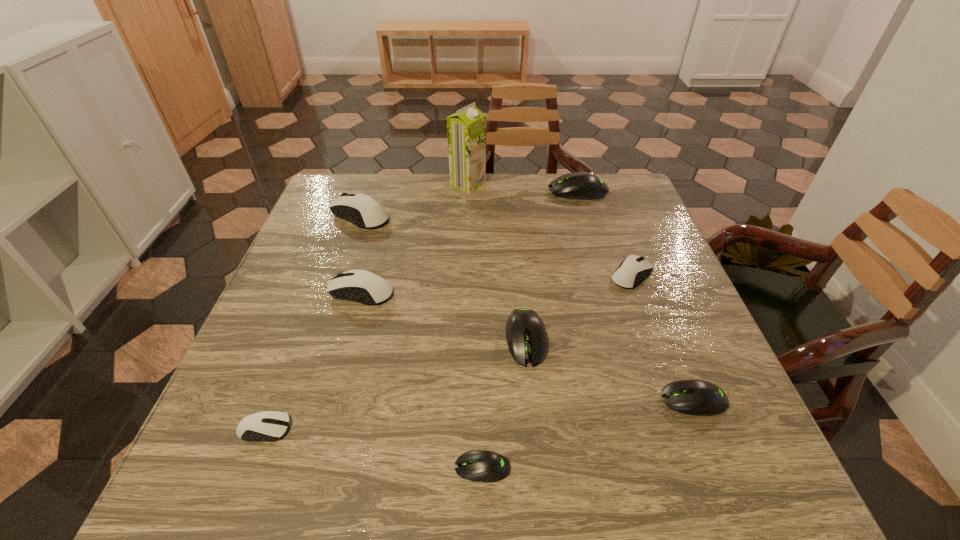
Image resolution: width=960 pixels, height=540 pixels. Identify the location of the third farthest gray computer mouse. click(693, 397).

Where is `the second smallest gray computer mouse`? The width and height of the screenshot is (960, 540). the second smallest gray computer mouse is located at coordinates (693, 397).

The width and height of the screenshot is (960, 540). What are the coordinates of `the smallest white mouse` in the screenshot? It's located at (250, 428).

Identify the location of the nearest white mouse. (250, 428).

What are the coordinates of `the shortest object` in the screenshot? It's located at (484, 466).

Find the location of a particular element. This screenshot has height=540, width=960. the shortest computer mouse is located at coordinates (484, 466).

Identify the location of vacant space situated on the left of the soya milk. The width and height of the screenshot is (960, 540). (366, 184).

Locate an element on the screen. This screenshot has height=540, width=960. free spot located on the right of the biggest white mouse is located at coordinates (416, 215).

Where is `free location located on the wheel side of the farthest computer mouse`? This screenshot has width=960, height=540. free location located on the wheel side of the farthest computer mouse is located at coordinates (425, 191).

The image size is (960, 540). I want to click on free location located 0.280m on the wheel side of the farthest computer mouse, so click(x=455, y=191).